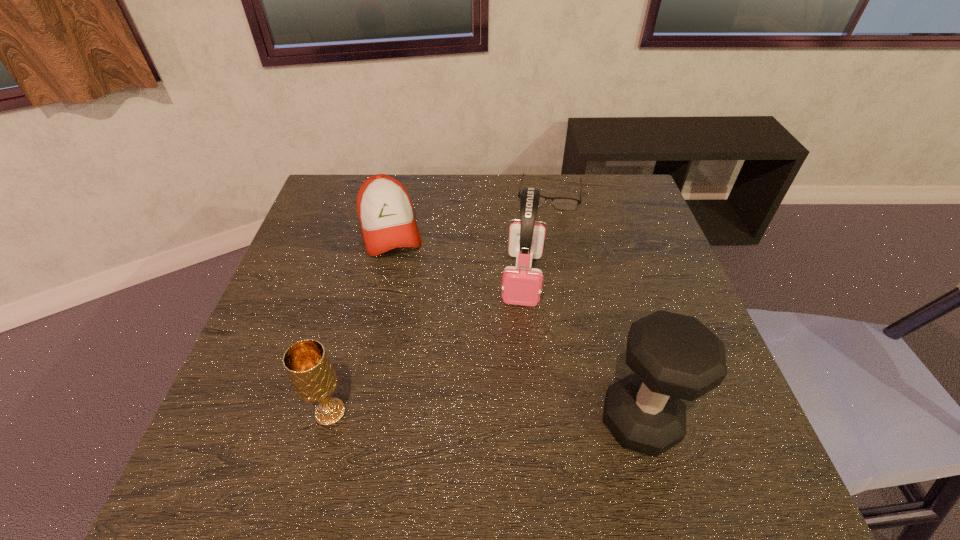
I want to click on empty location between the fourth tallest object and the dumbbell, so click(516, 325).

Identify the location of free spot between the second shortest object and the chalice. The width and height of the screenshot is (960, 540). (360, 321).

Where is `free space that is in between the spectacles and the third shortest object`? The width and height of the screenshot is (960, 540). free space that is in between the spectacles and the third shortest object is located at coordinates 440,302.

Where is `empty space between the spectacles and the chalice`? The image size is (960, 540). empty space between the spectacles and the chalice is located at coordinates [440, 302].

Locate an element on the screen. The image size is (960, 540). empty space between the earphone and the chalice is located at coordinates (426, 345).

This screenshot has height=540, width=960. Find the location of `vacant area that lies between the dumbbell and the earphone`. vacant area that lies between the dumbbell and the earphone is located at coordinates (582, 349).

Find the location of a particular element. vacant region between the shortest object and the third shortest object is located at coordinates (x=440, y=302).

Locate an element on the screen. unoccupied position between the chalice and the earphone is located at coordinates tap(426, 345).

Image resolution: width=960 pixels, height=540 pixels. I want to click on vacant area between the dumbbell and the spectacles, so click(x=595, y=307).

This screenshot has width=960, height=540. Find the location of `the third closest object to the spectacles`. the third closest object to the spectacles is located at coordinates (674, 356).